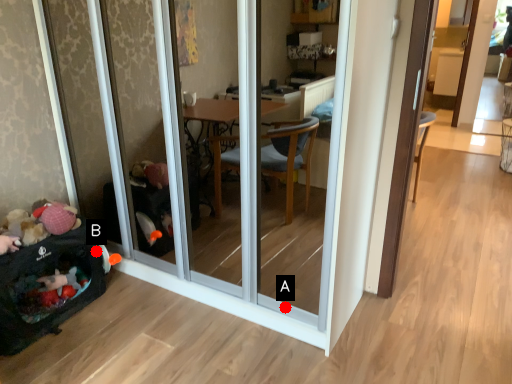
Question: Two points are circled on the image, labeled by A and B beside each circle. Which point is farther from the camera taking this photo?

Choices:
 (A) A is further
 (B) B is further

Answer: (B)